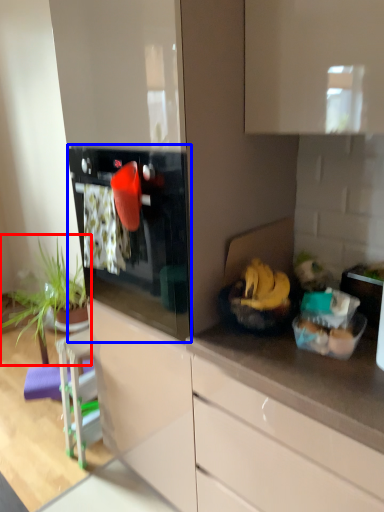
Question: Among these objects, which one is farthest to the camera, houseplant (highlighted by a red box) or oven (highlighted by a blue box)?

Choices:
 (A) houseplant
 (B) oven

Answer: (A)